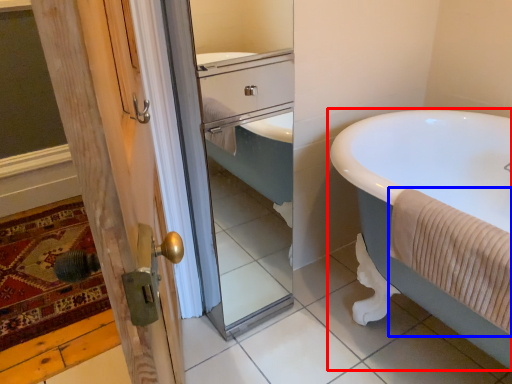
Question: Among these objects, which one is farthest to the camera, bathtub (highlighted by a red box) or bath towel (highlighted by a blue box)?

Choices:
 (A) bathtub
 (B) bath towel

Answer: (B)